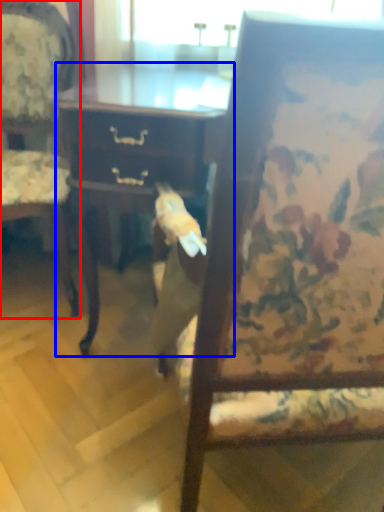
Question: Which object appears closest to the camera in this image, chair (highlighted by a red box) or desk (highlighted by a blue box)?

Choices:
 (A) chair
 (B) desk

Answer: (B)